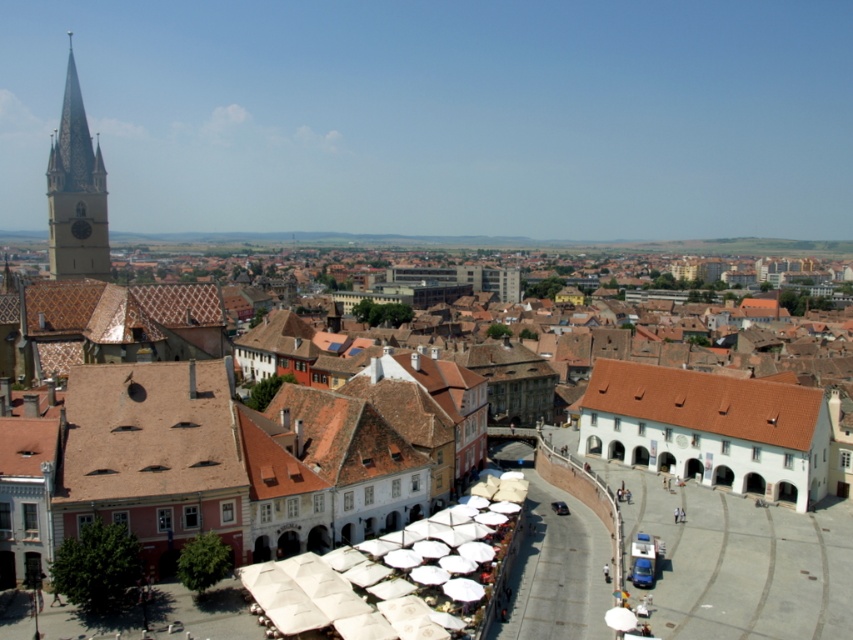
You are a tourist standing in the square and want to take a photo of the matte stone clock tower at upper left. You notice the white fabric umbrella at center is blocking your view. Which direction should you move to avoid the obstruction?

The white fabric umbrella at center is positioned on the right side of the matte stone clock tower at upper left. To avoid the obstruction, you should move to the right side of the clock tower.

You are a tourist standing at the top of the hill overlooking the historic town. You notice the matte white umbrellas at center in the square below. If you were to walk straight down the curved road leading to the square, would the umbrellas be directly in your path?

The matte white umbrellas at center are positioned at coordinates point [698,557], which means they are located at the center of the square. Walking straight down the curved road would lead you directly towards the center of the square, so yes, the umbrellas would be directly in your path.

You are standing at the viewpoint overlooking the historic town. You notice two points marked in the image. The first point is at coordinates point[357,579] and the second is at point[640,356]. Which of these two points is closer to you?

Point[357,579] is in front of point[640,356], so it is closer to you.